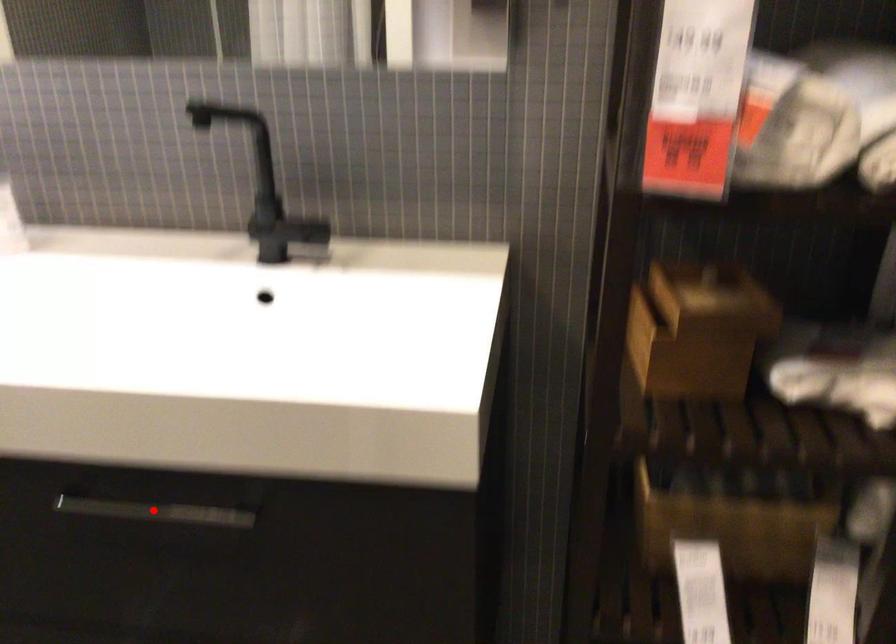
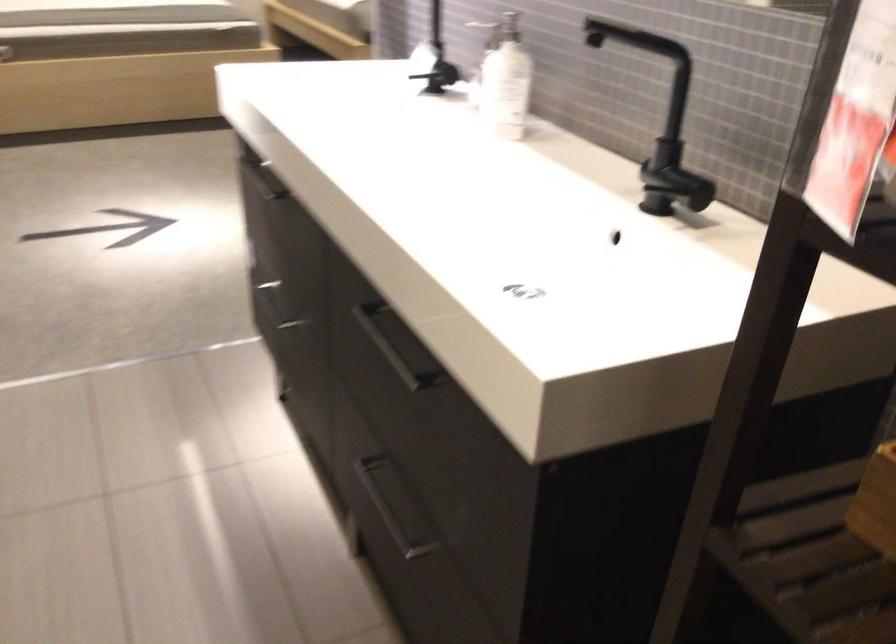
Question: I am providing you with two images of the same scene from different viewpoints. In image1, a red point is highlighted. Considering the same 3D point in image2, which of the following is correct?

Choices:
 (A) It is closer
 (B) It is farther

Answer: (B)